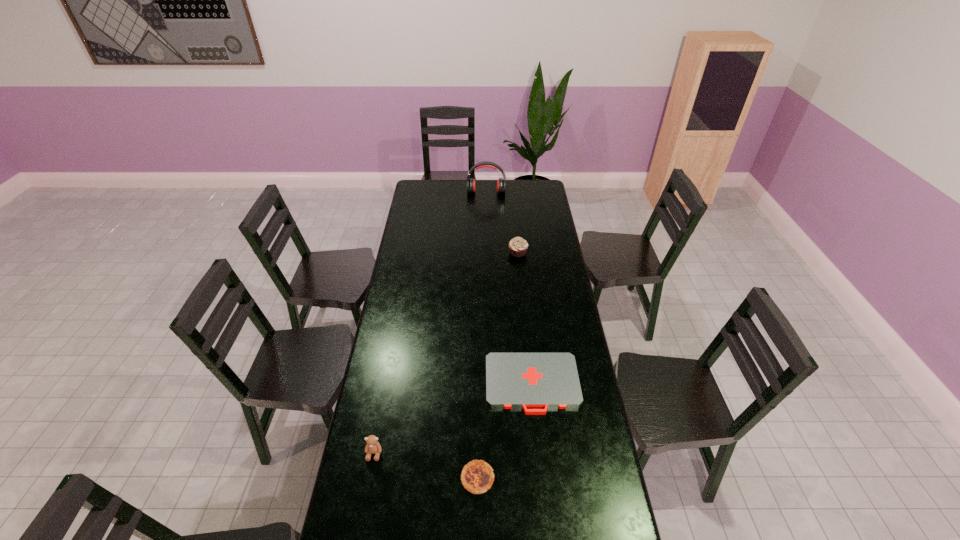
Locate an element on the screen. This screenshot has height=540, width=960. vacant space positioned 0.090m on the right of the muffin is located at coordinates (545, 252).

Image resolution: width=960 pixels, height=540 pixels. What are the coordinates of `vacant space located on the front-facing side of the leftmost object` in the screenshot? It's located at (369, 483).

Identify the location of free space located on the left of the quiche. [393, 478].

The height and width of the screenshot is (540, 960). In order to click on free space located 0.290m on handle side the shortest object in this screenshot , I will do `click(544, 498)`.

You are a GUI agent. You are given a task and a screenshot of the screen. Output one action in this format:
    pyautogui.click(x=<x>, y=<y>)
    Task: Click on the object that is at the far edge
    
    Given the screenshot: What is the action you would take?
    click(501, 183)

At what (x,y) coordinates should I click in order to perform the action: click on object that is at the left edge. Please return your answer as a coordinate pair (x, y). This screenshot has height=540, width=960. Looking at the image, I should click on (372, 447).

In order to click on object that is positioned at the right edge in this screenshot , I will do `click(523, 380)`.

Where is `free space at the far edge`? This screenshot has width=960, height=540. free space at the far edge is located at coordinates (510, 196).

Where is `vacant region at the left edge of the desktop`? vacant region at the left edge of the desktop is located at coordinates (391, 306).

Image resolution: width=960 pixels, height=540 pixels. In the image, there is a desktop. Identify the location of free space at the right edge. (581, 349).